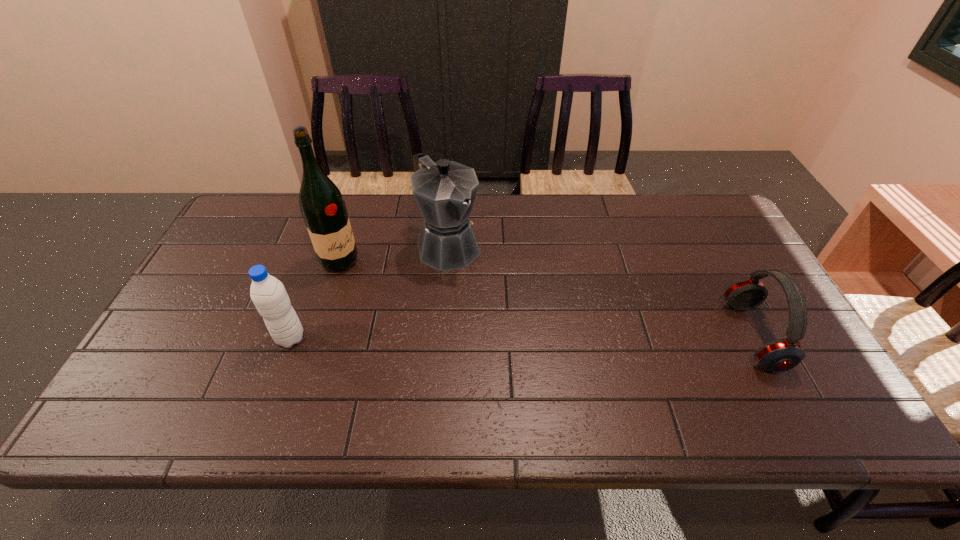
I want to click on unoccupied area between the earphone and the second shortest object, so click(x=521, y=337).

Find the location of a particular element. free spot between the shortest object and the second tallest object is located at coordinates [601, 291].

You are a GUI agent. You are given a task and a screenshot of the screen. Output one action in this format:
    pyautogui.click(x=<x>, y=<y>)
    Task: Click on the free spot between the water bottle and the third object from left to right
    This screenshot has height=540, width=960.
    Given the screenshot: What is the action you would take?
    pyautogui.click(x=370, y=292)

This screenshot has height=540, width=960. I want to click on vacant area that lies between the earphone and the coffeepot, so click(x=601, y=291).

Choose which object is the nearest neighbor to the shortest object. Please provide its 2D coordinates. Your answer should be formatted as a tuple, i.e. [(x, y)], where the tuple contains the x and y coordinates of a point satisfying the conditions above.

[(445, 191)]

The width and height of the screenshot is (960, 540). In order to click on object that is the closest to the earphone in this screenshot , I will do `click(445, 191)`.

Identify the location of free space that satisfies the following two spatial constraints: 1. on the front side of the earphone; 2. on the ear cups of the coffeepot. This screenshot has height=540, width=960. (443, 336).